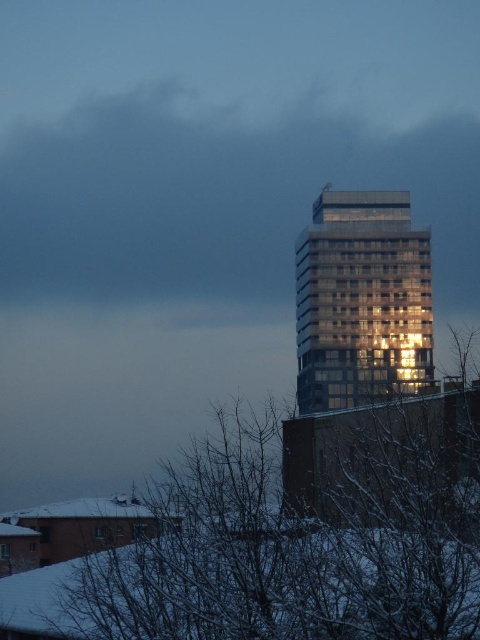
Question: Which of the following is the farthest from the observer?

Choices:
 (A) snowy branches at lower right
 (B) reflective glass building at center

Answer: (B)

Question: Can you confirm if snowy branches at lower right is bigger than reflective glass building at center?

Choices:
 (A) no
 (B) yes

Answer: (A)

Question: Does snowy branches at lower right have a smaller size compared to reflective glass building at center?

Choices:
 (A) yes
 (B) no

Answer: (A)

Question: Is snowy branches at lower right to the left of reflective glass building at center from the viewer's perspective?

Choices:
 (A) yes
 (B) no

Answer: (A)

Question: Which point is closer to the camera?

Choices:
 (A) snowy branches at lower right
 (B) reflective glass building at center

Answer: (A)